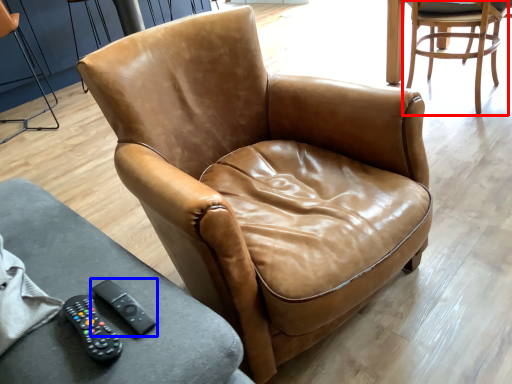
Question: Which of the following is the farthest to the observer, chair (highlighted by a red box) or remote (highlighted by a blue box)?

Choices:
 (A) chair
 (B) remote

Answer: (A)